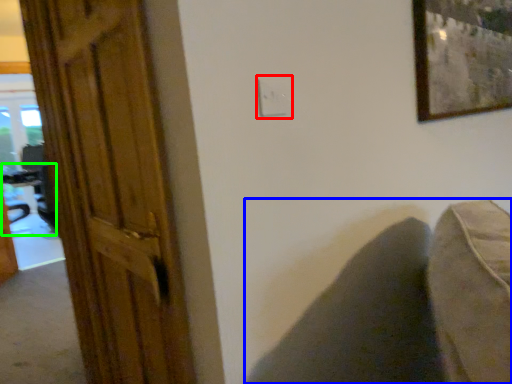
Question: Considering the real-world distances, which object is farthest from electric outlet (highlighted by a red box)? swivel chair (highlighted by a blue box) or table (highlighted by a green box)?

Choices:
 (A) swivel chair
 (B) table

Answer: (B)